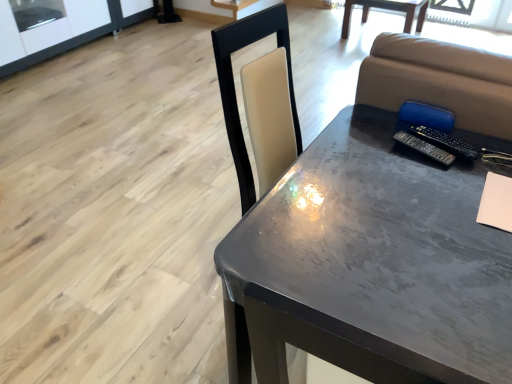
Find the location of `vacant space that is to the left of black plastic remote at upper right, which ranks as the second remote in left-to-right order`. vacant space that is to the left of black plastic remote at upper right, which ranks as the second remote in left-to-right order is located at coordinates (380, 153).